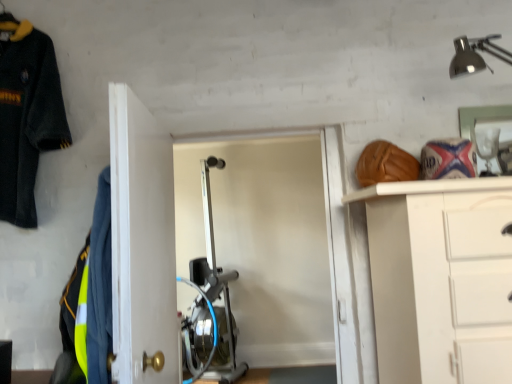
Question: From the image's perspective, is reflective yellow-green fabric at left, the 2th uniform positioned from the back, on dark blue fleece jacket at upper left, which is the second uniform in bottom-to-top order?

Choices:
 (A) yes
 (B) no

Answer: (B)

Question: Is reflective yellow-green fabric at left, the 1th uniform when ordered from right to left, shorter than dark blue fleece jacket at upper left, positioned as the first uniform in left-to-right order?

Choices:
 (A) no
 (B) yes

Answer: (B)

Question: Considering the relative sizes of reflective yellow-green fabric at left, the 1th uniform when ordered from right to left, and dark blue fleece jacket at upper left, which ranks as the first uniform in back-to-front order, in the image provided, is reflective yellow-green fabric at left, the 1th uniform when ordered from right to left, smaller than dark blue fleece jacket at upper left, which ranks as the first uniform in back-to-front order,?

Choices:
 (A) no
 (B) yes

Answer: (B)

Question: Is reflective yellow-green fabric at left, the 2th uniform positioned from the back, at the left side of dark blue fleece jacket at upper left, marked as the 1th uniform in a top-to-bottom arrangement?

Choices:
 (A) no
 (B) yes

Answer: (A)

Question: Is reflective yellow-green fabric at left, which ranks as the second uniform in left-to-right order, not inside dark blue fleece jacket at upper left, arranged as the 2th uniform when viewed from the front?

Choices:
 (A) no
 (B) yes

Answer: (B)

Question: Does reflective yellow-green fabric at left, the first uniform in the front-to-back sequence, have a greater height compared to dark blue fleece jacket at upper left, the second uniform positioned from the right?

Choices:
 (A) no
 (B) yes

Answer: (A)

Question: Does reflective yellow-green fabric at left, the first uniform when ordered from bottom to top, have a smaller size compared to white glossy door at center?

Choices:
 (A) no
 (B) yes

Answer: (B)

Question: Is reflective yellow-green fabric at left, the first uniform in the front-to-back sequence, at the right side of white glossy door at center?

Choices:
 (A) no
 (B) yes

Answer: (A)

Question: From a real-world perspective, is reflective yellow-green fabric at left, which ranks as the second uniform in left-to-right order, physically below white glossy door at center?

Choices:
 (A) yes
 (B) no

Answer: (A)

Question: From the image's perspective, is reflective yellow-green fabric at left, the 2th uniform positioned from the back, beneath white glossy door at center?

Choices:
 (A) yes
 (B) no

Answer: (A)

Question: Could you tell me if reflective yellow-green fabric at left, the 1th uniform when ordered from right to left, is facing white glossy door at center?

Choices:
 (A) yes
 (B) no

Answer: (A)

Question: Is the depth of reflective yellow-green fabric at left, the first uniform when ordered from bottom to top, greater than that of white glossy door at center?

Choices:
 (A) yes
 (B) no

Answer: (A)

Question: Can you confirm if dark blue fleece jacket at upper left, arranged as the 2th uniform when viewed from the front, is shorter than reflective yellow-green fabric at left, arranged as the second uniform when viewed from the top?

Choices:
 (A) no
 (B) yes

Answer: (A)